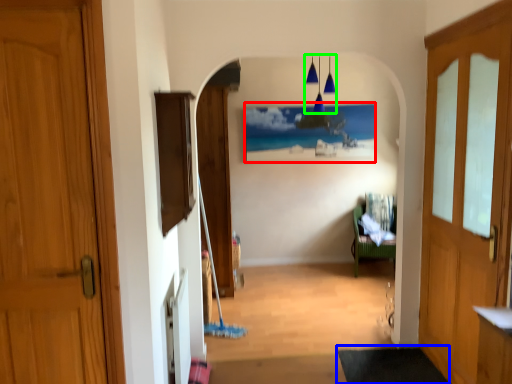
Question: Which object is the farthest from picture frame (highlighted by a red box)? Choose among these: doormat (highlighted by a blue box) or lamp (highlighted by a green box).

Choices:
 (A) doormat
 (B) lamp

Answer: (A)